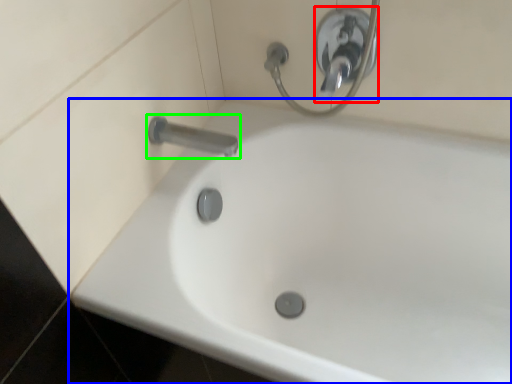
Question: Which object is positioned closest to shower (highlighted by a red box)? Select from bathtub (highlighted by a blue box) and tap (highlighted by a green box).

Choices:
 (A) bathtub
 (B) tap

Answer: (B)